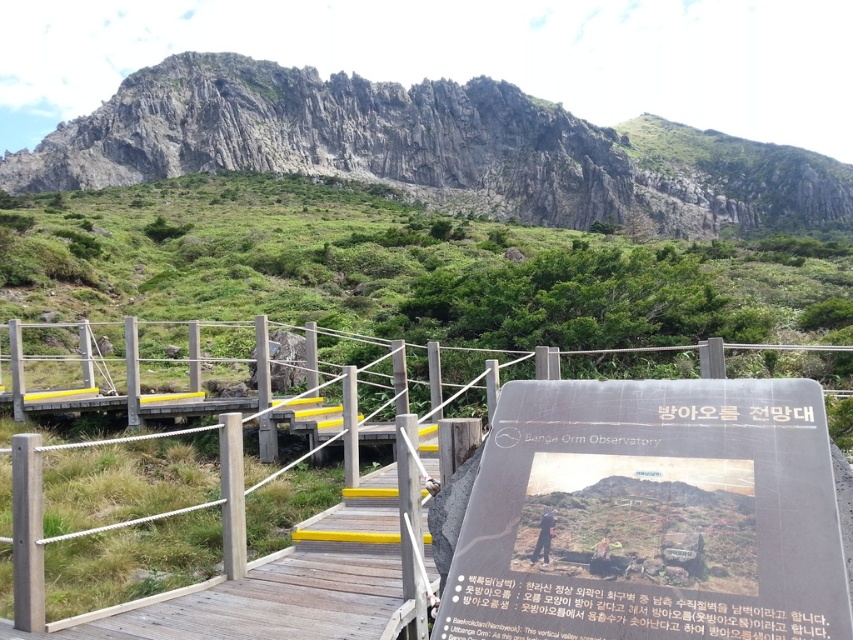
You are standing at the starting point of the wooden pathway and want to reach the point marked at coordinates point (616,404). If your walking speed is 3 feet per second, how many seconds will it take you to reach that point?

The distance of point (616,404) from camera is 54.95 feet. At a walking speed of 3 feet per second, it will take approximately 18.3 seconds to reach the point.